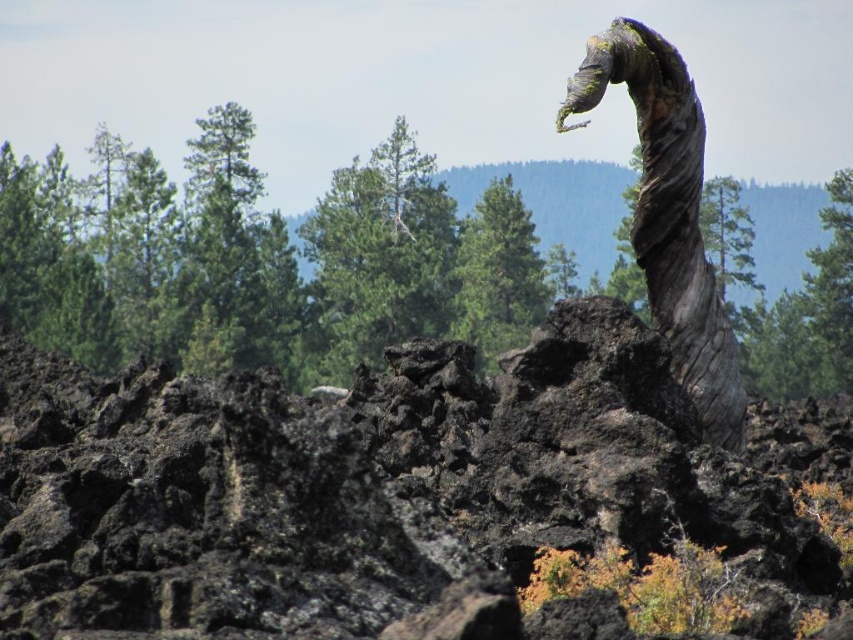
You are a geologist examining the image of the rugged landscape. You notice a point marked at coordinates (416, 500). Based on the scene description, what does this point most likely indicate?

The point at (416, 500) marks the location of black volcanic rock at center.

You are a hiker who wants to take a photo of the gray rough bark tree trunk at right with the black volcanic rock at center in the background. Can you position yourself so that the tree trunk is above the volcanic rock in the photo?

The black volcanic rock at center is located below the gray rough bark tree trunk at right, so yes, you can position yourself to have the gray rough bark tree trunk at right appear above the black volcanic rock at center in the photo.

You are a hiker navigating through this volcanic landscape. You need to reach the gray rough bark tree trunk at right but must avoid stepping on the black volcanic rock at center. Which direction should you move relative to the tree trunk to avoid the rock?

The black volcanic rock at center is positioned on the left side of the gray rough bark tree trunk at right. To avoid stepping on the rock, you should move to the right side of the tree trunk.